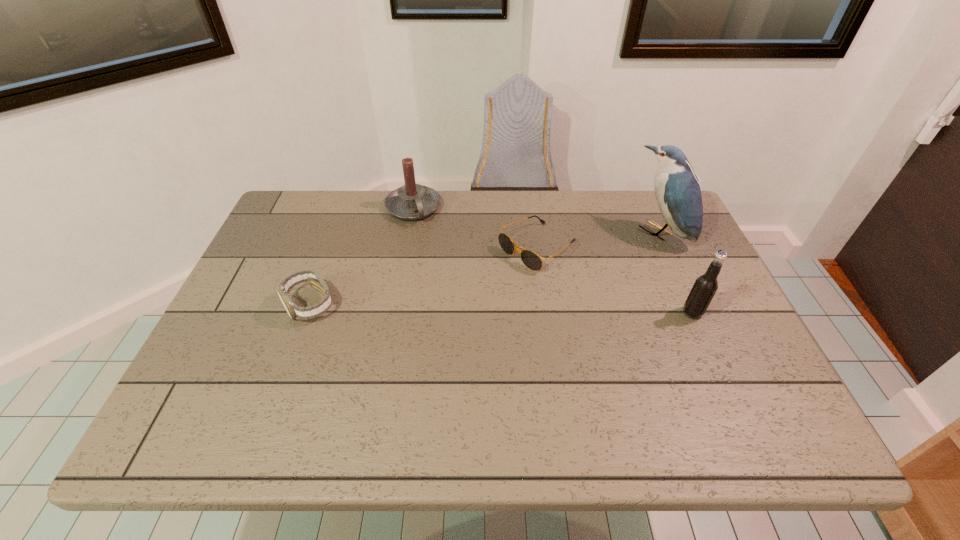
At what (x,y) coordinates should I click in order to perform the action: click on free area in between the tallest object and the third object from left to right. Please return your answer as a coordinate pair (x, y). This screenshot has width=960, height=540. Looking at the image, I should click on (598, 240).

Choose which object is the third nearest neighbor to the second shortest object. Please provide its 2D coordinates. Your answer should be formatted as a tuple, i.e. [(x, y)], where the tuple contains the x and y coordinates of a point satisfying the conditions above.

[(677, 190)]

The width and height of the screenshot is (960, 540). Find the location of `object that can be found as the closest to the root beer`. object that can be found as the closest to the root beer is located at coordinates (677, 190).

Locate an element on the screen. The width and height of the screenshot is (960, 540). vacant area in the image that satisfies the following two spatial constraints: 1. on the front side of the candle; 2. on the right side of the bird is located at coordinates 409,232.

At what (x,y) coordinates should I click in order to perform the action: click on free space that satisfies the following two spatial constraints: 1. on the face of the leftmost object; 2. on the label of the root beer. Please return your answer as a coordinate pair (x, y). The width and height of the screenshot is (960, 540). Looking at the image, I should click on (307, 313).

Where is `vacant region that satisfies the following two spatial constraints: 1. on the front side of the fourth object from right to left; 2. on the label of the root beer`? The width and height of the screenshot is (960, 540). vacant region that satisfies the following two spatial constraints: 1. on the front side of the fourth object from right to left; 2. on the label of the root beer is located at coordinates (395, 313).

Where is `free spot that satisfies the following two spatial constraints: 1. on the front side of the fourth object from right to left; 2. on the label of the root beer`? This screenshot has width=960, height=540. free spot that satisfies the following two spatial constraints: 1. on the front side of the fourth object from right to left; 2. on the label of the root beer is located at coordinates (395, 313).